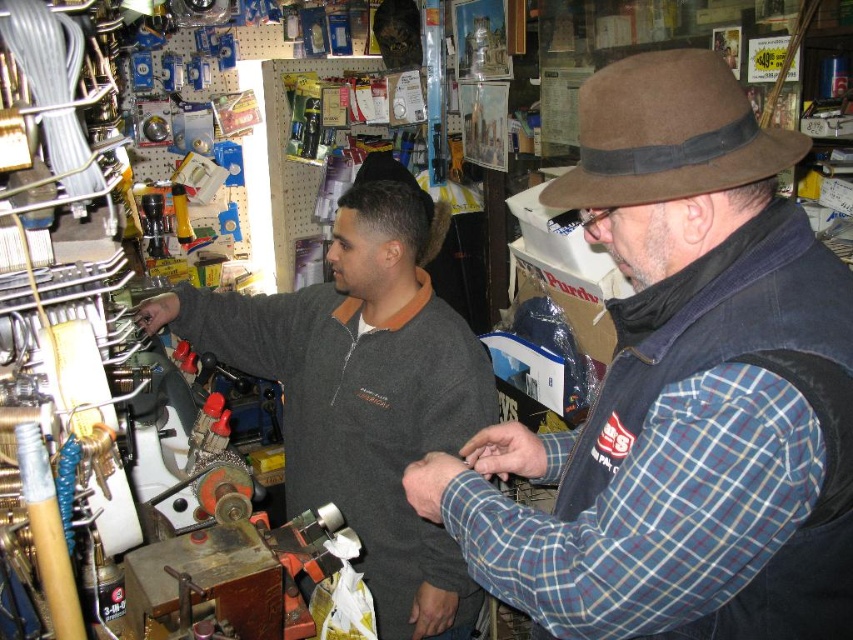
Question: Which point appears farthest from the camera in this image?

Choices:
 (A) (753, 120)
 (B) (178, 288)

Answer: (B)

Question: Which is farther from the brown felt hat at upper right?

Choices:
 (A) dark gray sweater at center
 (B) brown suede fedora at upper right

Answer: (A)

Question: Which object is positioned closest to the dark gray sweater at center?

Choices:
 (A) brown felt hat at upper right
 (B) brown suede fedora at upper right

Answer: (A)

Question: Does brown felt hat at upper right appear over dark gray sweater at center?

Choices:
 (A) yes
 (B) no

Answer: (A)

Question: Can you confirm if brown felt hat at upper right is smaller than brown suede fedora at upper right?

Choices:
 (A) no
 (B) yes

Answer: (A)

Question: Can you confirm if dark gray sweater at center is smaller than brown suede fedora at upper right?

Choices:
 (A) yes
 (B) no

Answer: (B)